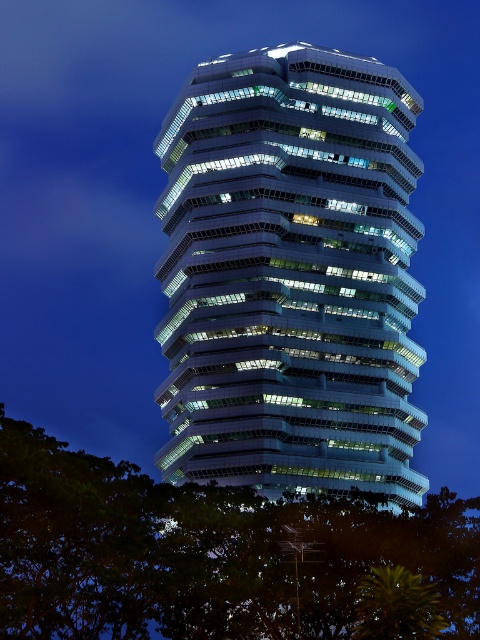
You are an architect evaluating the visibility of the white glass tower at center from the green leafy tree at lower left. Considering their sizes and positions, which object would appear bigger in the scene?

The white glass tower at center appears bigger than the green leafy tree at lower left because it has a larger size compared to the tree.

Consider the image. You are standing in a park and see the white glass tower at center and the green leafy tree at lower left. Which object is higher from the ground?

The white glass tower at center is located above the green leafy tree at lower left, so it is higher from the ground.

You are an architect evaluating the design of the white glass tower at center and the green leafy tree at lower left. Which structure has a narrower width?

The white glass tower at center is thinner than the green leafy tree at lower left, so the white glass tower at center has a narrower width.